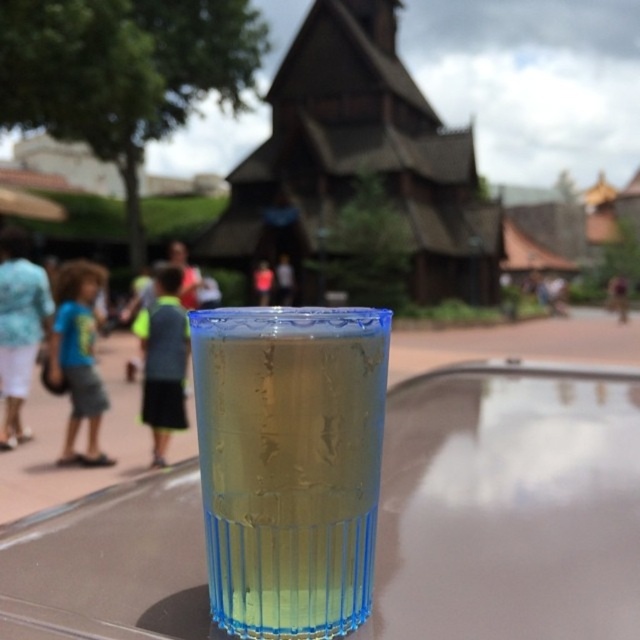
Between translucent plastic cup at center and matte blue shorts at left, which one has more height?

With more height is matte blue shorts at left.

Is translucent plastic cup at center bigger than matte blue shorts at left?

Actually, translucent plastic cup at center might be smaller than matte blue shorts at left.

In order to click on translucent plastic cup at center in this screenshot , I will do `click(289, 464)`.

Who is positioned more to the left, matte blue shorts at left or matte blue shirt at center?

From the viewer's perspective, matte blue shorts at left appears more on the left side.

Does matte blue shorts at left appear on the left side of matte blue shirt at center?

Yes, matte blue shorts at left is to the left of matte blue shirt at center.

Locate an element on the screen. matte blue shorts at left is located at coordinates (77, 356).

Is point (205, 312) positioned behind point (266, 262)?

No, it is not.

Is translucent plastic cup at center wider than blue fabric shirt at center?

Yes.

Does point (368, 531) come closer to viewer compared to point (268, 268)?

Yes, it is in front of point (268, 268).

Where is `translucent plastic cup at center`? The width and height of the screenshot is (640, 640). translucent plastic cup at center is located at coordinates (289, 464).